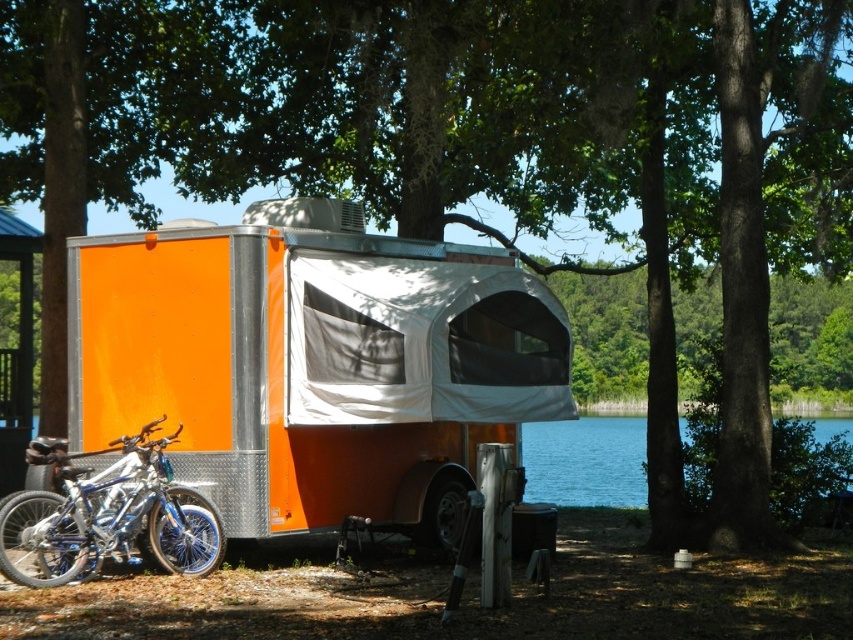
You are standing in front of the orange metallic camper at center. A friend tells you there is a point marked at coordinates (312,362) on the camper. Based on the scene description, where would this point most likely be located?

The point at coordinates (312,362) is on the orange metallic camper at center, so it is located on the camper itself.